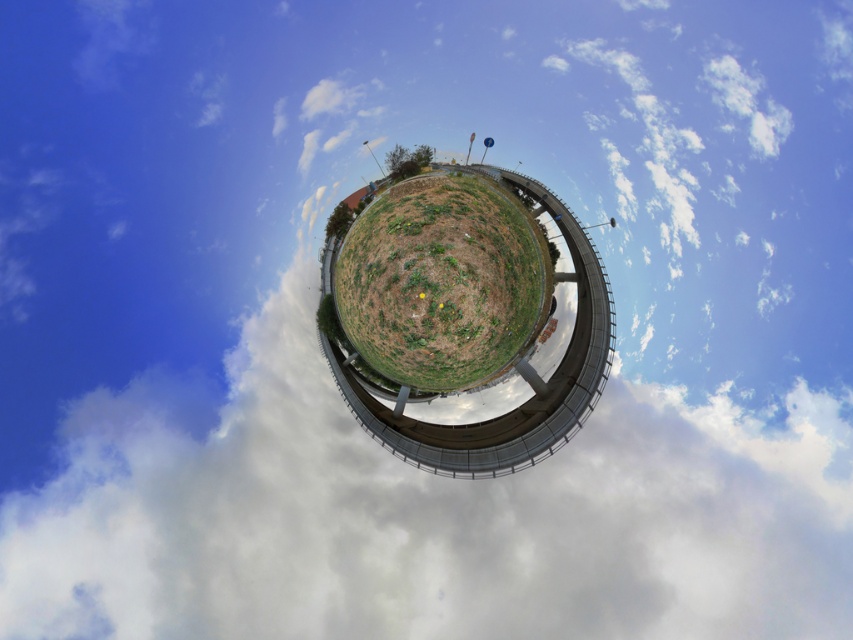
Question: Is green matte grass at center further to the viewer compared to green leafy tree at center?

Choices:
 (A) no
 (B) yes

Answer: (A)

Question: Does green matte grass at center have a lesser width compared to green leafy tree at center?

Choices:
 (A) yes
 (B) no

Answer: (B)

Question: Is green matte grass at center below green leafy tree at upper center?

Choices:
 (A) yes
 (B) no

Answer: (A)

Question: Which point appears closest to the camera in this image?

Choices:
 (A) (405, 172)
 (B) (349, 221)
 (C) (457, 364)

Answer: (C)

Question: Which of these objects is positioned closest to the green leafy tree at upper center?

Choices:
 (A) green leafy tree at center
 (B) green matte grass at center

Answer: (A)

Question: Which object is the farthest from the green matte grass at center?

Choices:
 (A) green leafy tree at upper center
 (B) green leafy tree at center

Answer: (B)